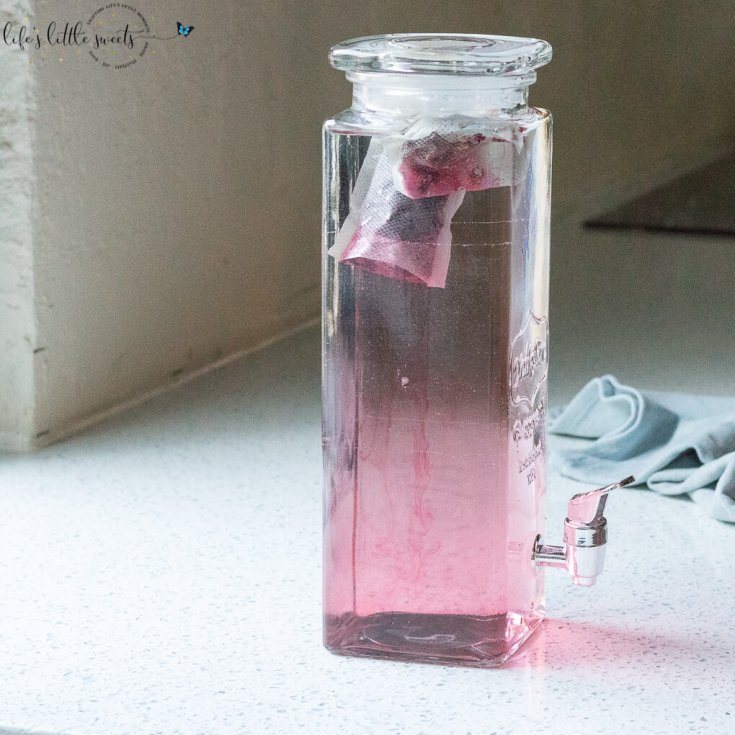
Locate an element on the screen. The image size is (735, 735). brown board is located at coordinates (686, 206).